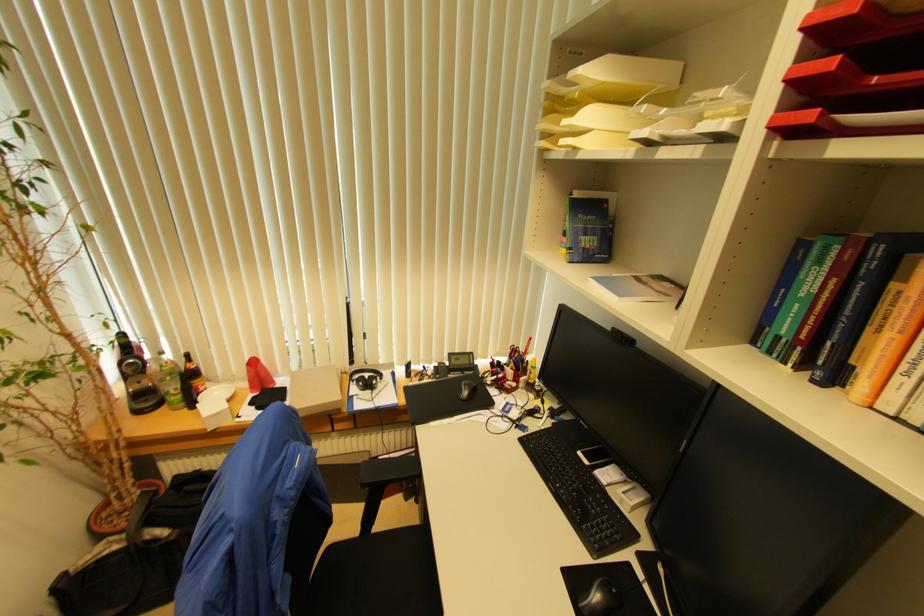
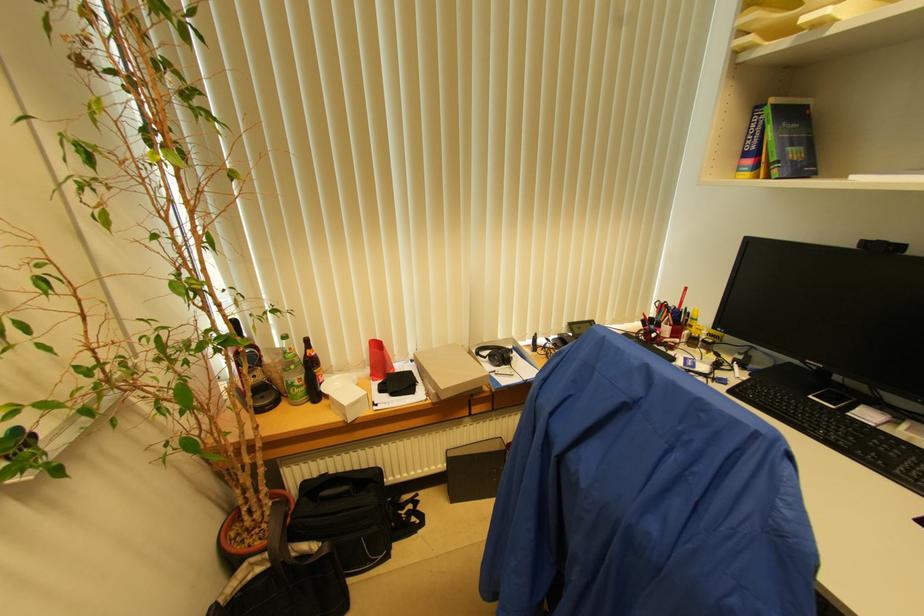
The point at (572, 252) is marked in the first image. Where is the corresponding point in the second image?

(780, 166)